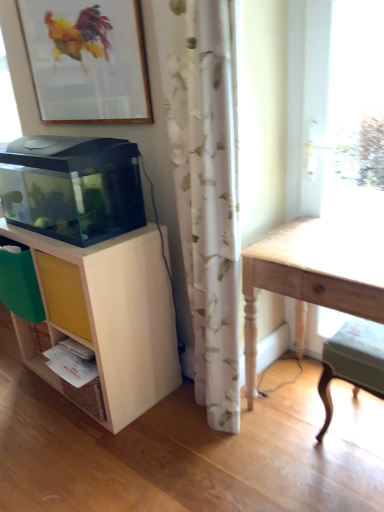
Question: Can you confirm if wooden framed picture at upper left is bigger than light wood table at right?

Choices:
 (A) yes
 (B) no

Answer: (B)

Question: Can you confirm if wooden framed picture at upper left is wider than light wood table at right?

Choices:
 (A) yes
 (B) no

Answer: (B)

Question: Considering the relative positions of wooden framed picture at upper left and light wood table at right in the image provided, is wooden framed picture at upper left behind light wood table at right?

Choices:
 (A) yes
 (B) no

Answer: (A)

Question: Does wooden framed picture at upper left appear on the right side of light wood table at right?

Choices:
 (A) no
 (B) yes

Answer: (A)

Question: Is there a large distance between wooden framed picture at upper left and light wood table at right?

Choices:
 (A) no
 (B) yes

Answer: (A)

Question: Considering the relative sizes of wooden framed picture at upper left and light wood table at right in the image provided, is wooden framed picture at upper left thinner than light wood table at right?

Choices:
 (A) yes
 (B) no

Answer: (A)

Question: Does wooden framed picture at upper left appear on the right side of light green fabric step stool at lower right?

Choices:
 (A) yes
 (B) no

Answer: (B)

Question: From the image's perspective, does wooden framed picture at upper left appear lower than light green fabric step stool at lower right?

Choices:
 (A) no
 (B) yes

Answer: (A)

Question: Is wooden framed picture at upper left facing towards light green fabric step stool at lower right?

Choices:
 (A) yes
 (B) no

Answer: (B)

Question: From a real-world perspective, is wooden framed picture at upper left located higher than light green fabric step stool at lower right?

Choices:
 (A) no
 (B) yes

Answer: (B)

Question: Is wooden framed picture at upper left not near light green fabric step stool at lower right?

Choices:
 (A) no
 (B) yes

Answer: (B)

Question: Are wooden framed picture at upper left and light green fabric step stool at lower right beside each other?

Choices:
 (A) yes
 (B) no

Answer: (B)

Question: Is transparent glass aquarium at left to the left of light wood table at right from the viewer's perspective?

Choices:
 (A) no
 (B) yes

Answer: (B)